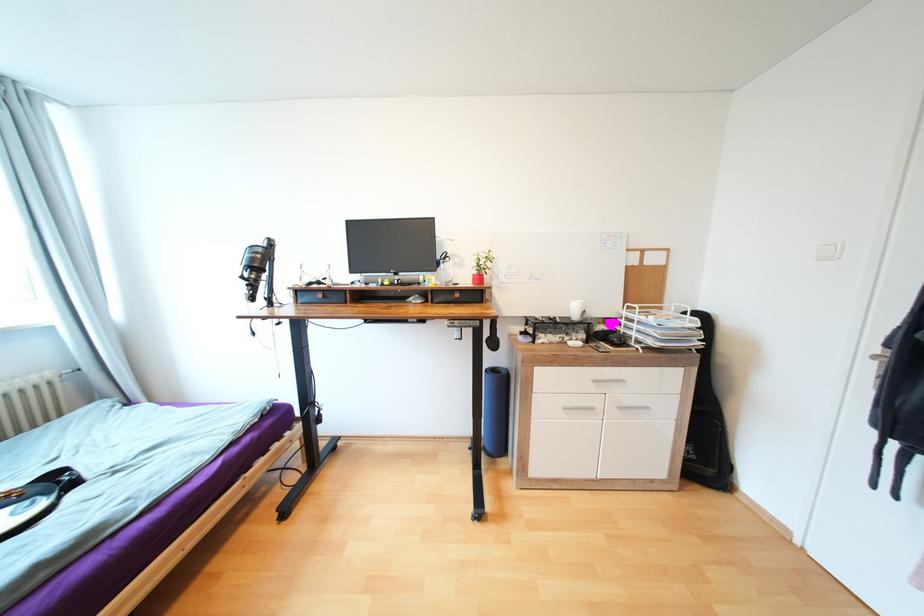
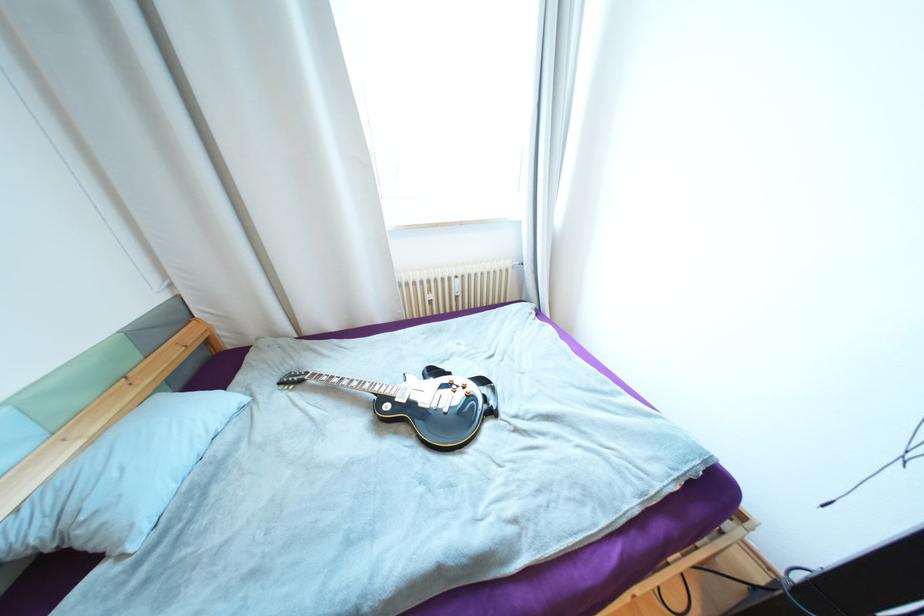
Where in the second image is the point corresponding to [79,484] from the first image?

(497, 413)